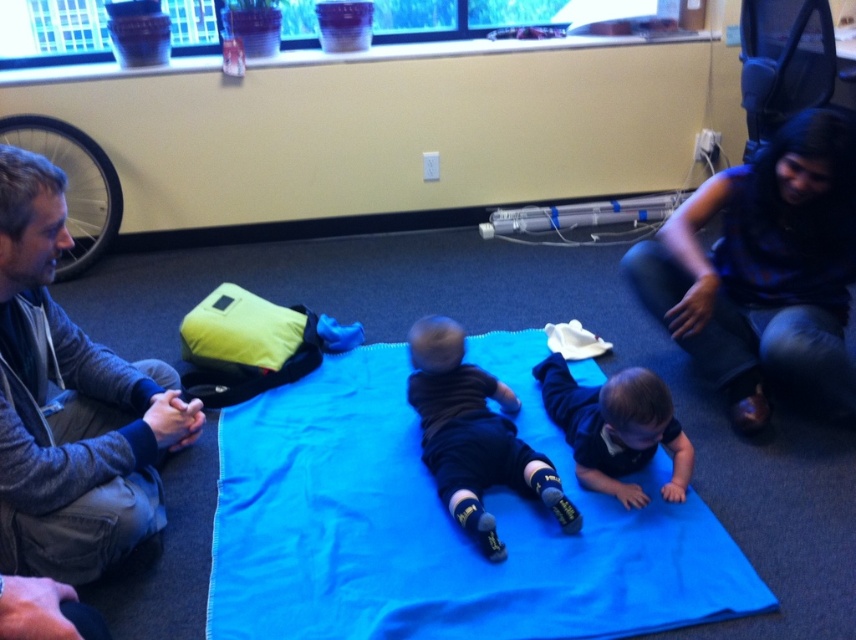
Is gray fleece jacket at left closer to the viewer compared to black matte socks at center?

Yes, gray fleece jacket at left is in front of black matte socks at center.

Is point (58, 332) more distant than point (432, 348)?

No.

Does point (33, 541) come behind point (480, 460)?

No, (33, 541) is in front of (480, 460).

Identify the location of gray fleece jacket at left. The height and width of the screenshot is (640, 856). (70, 404).

Which is more to the left, blue fabric at center or black matte socks at center?

blue fabric at center is more to the left.

Does blue fabric at center appear on the right side of black matte socks at center?

Incorrect, blue fabric at center is not on the right side of black matte socks at center.

Is point (556, 568) farther from viewer compared to point (513, 444)?

No, it is not.

This screenshot has height=640, width=856. In order to click on blue fabric at center in this screenshot , I will do `click(440, 525)`.

Does gray fleece jacket at left appear over dark blue fabric at center?

Yes.

Consider the image. Is gray fleece jacket at left bigger than dark blue fabric at center?

Indeed, gray fleece jacket at left has a larger size compared to dark blue fabric at center.

Image resolution: width=856 pixels, height=640 pixels. I want to click on gray fleece jacket at left, so click(70, 404).